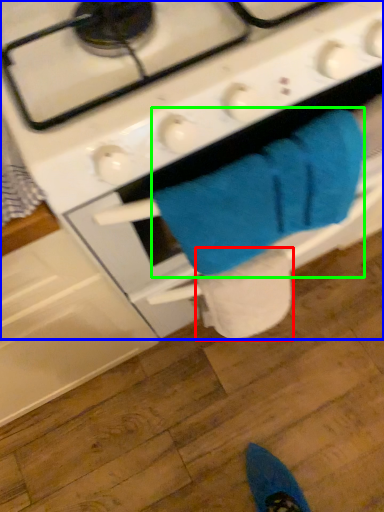
Question: Estimate the real-world distances between objects in this image. Which object is farther from toilet paper (highlighted by a red box), gas stove (highlighted by a blue box) or bath towel (highlighted by a green box)?

Choices:
 (A) gas stove
 (B) bath towel

Answer: (A)